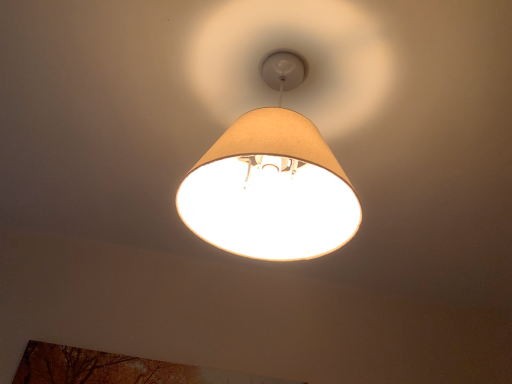
Describe the element at coordinates (97, 367) in the screenshot. I see `autumn leaves painting at lower left` at that location.

Locate an element on the screen. This screenshot has height=384, width=512. autumn leaves painting at lower left is located at coordinates (97, 367).

Measure the distance between point (133, 377) and camera.

1.48 meters.

This screenshot has width=512, height=384. Find the location of `beige fabric lampshade at center`. beige fabric lampshade at center is located at coordinates (271, 183).

The image size is (512, 384). What do you see at coordinates (271, 183) in the screenshot? I see `beige fabric lampshade at center` at bounding box center [271, 183].

Find the location of a particular element. autumn leaves painting at lower left is located at coordinates (97, 367).

Considering the relative positions of autumn leaves painting at lower left and beige fabric lampshade at center in the image provided, is autumn leaves painting at lower left to the left of beige fabric lampshade at center from the viewer's perspective?

Correct, you'll find autumn leaves painting at lower left to the left of beige fabric lampshade at center.

Is autumn leaves painting at lower left in front of beige fabric lampshade at center?

No, autumn leaves painting at lower left is behind beige fabric lampshade at center.

Is point (56, 373) more distant than point (282, 64)?

Yes, point (56, 373) is farther from viewer.

From the image's perspective, between autumn leaves painting at lower left and beige fabric lampshade at center, who is located below?

autumn leaves painting at lower left, from the image's perspective.

From a real-world perspective, is autumn leaves painting at lower left positioned over beige fabric lampshade at center based on gravity?

Actually, autumn leaves painting at lower left is physically below beige fabric lampshade at center in the real world.

In terms of width, does autumn leaves painting at lower left look wider or thinner when compared to beige fabric lampshade at center?

autumn leaves painting at lower left is thinner than beige fabric lampshade at center.

Which of these two, autumn leaves painting at lower left or beige fabric lampshade at center, stands shorter?

With less height is autumn leaves painting at lower left.

Can you confirm if autumn leaves painting at lower left is smaller than beige fabric lampshade at center?

Correct, autumn leaves painting at lower left occupies less space than beige fabric lampshade at center.

Would you say beige fabric lampshade at center is part of autumn leaves painting at lower left's contents?

No, beige fabric lampshade at center is not a part of autumn leaves painting at lower left.

Can you see autumn leaves painting at lower left touching beige fabric lampshade at center?

No, autumn leaves painting at lower left is not with beige fabric lampshade at center.

Is beige fabric lampshade at center at the back of autumn leaves painting at lower left?

No.

Can you tell me how much autumn leaves painting at lower left and beige fabric lampshade at center differ in facing direction?

The angular difference between autumn leaves painting at lower left and beige fabric lampshade at center is 4.1 degrees.

Locate an element on the screen. The image size is (512, 384). lamp in front of the autumn leaves painting at lower left is located at coordinates coord(271,183).

Does beige fabric lampshade at center appear on the left side of autumn leaves painting at lower left?

In fact, beige fabric lampshade at center is to the right of autumn leaves painting at lower left.

Which object is further away from the camera, beige fabric lampshade at center or autumn leaves painting at lower left?

autumn leaves painting at lower left is further away from the camera.

Which is closer, (x=252, y=235) or (x=174, y=373)?

The point (x=252, y=235) is closer.

From the image's perspective, which object appears higher, beige fabric lampshade at center or autumn leaves painting at lower left?

beige fabric lampshade at center, from the image's perspective.

From a real-world perspective, is beige fabric lampshade at center above or below autumn leaves painting at lower left?

From a real-world perspective, beige fabric lampshade at center is physically above autumn leaves painting at lower left.

Does beige fabric lampshade at center have a greater width compared to autumn leaves painting at lower left?

Yes, beige fabric lampshade at center is wider than autumn leaves painting at lower left.

Does beige fabric lampshade at center have a lesser height compared to autumn leaves painting at lower left?

No, beige fabric lampshade at center is not shorter than autumn leaves painting at lower left.

Does beige fabric lampshade at center have a larger size compared to autumn leaves painting at lower left?

Correct, beige fabric lampshade at center is larger in size than autumn leaves painting at lower left.

Is beige fabric lampshade at center positioned beyond the bounds of autumn leaves painting at lower left?

Yes.

Is there a large distance between beige fabric lampshade at center and autumn leaves painting at lower left?

Absolutely, beige fabric lampshade at center is distant from autumn leaves painting at lower left.

Is beige fabric lampshade at center looking in the opposite direction of autumn leaves painting at lower left?

Correct, beige fabric lampshade at center is looking away from autumn leaves painting at lower left.

Can you tell me how much beige fabric lampshade at center and autumn leaves painting at lower left differ in facing direction?

The angle between the facing direction of beige fabric lampshade at center and the facing direction of autumn leaves painting at lower left is 4.1 degrees.

You are a GUI agent. You are given a task and a screenshot of the screen. Output one action in this format:
    pyautogui.click(x=<x>, y=<y>)
    Task: Click on the tree on the left of beige fabric lampshade at center
    This screenshot has width=512, height=384.
    Given the screenshot: What is the action you would take?
    pyautogui.click(x=97, y=367)

The height and width of the screenshot is (384, 512). Identify the location of lamp that is above the autumn leaves painting at lower left (from a real-world perspective). (271, 183).

This screenshot has height=384, width=512. I want to click on tree that is behind the beige fabric lampshade at center, so click(97, 367).